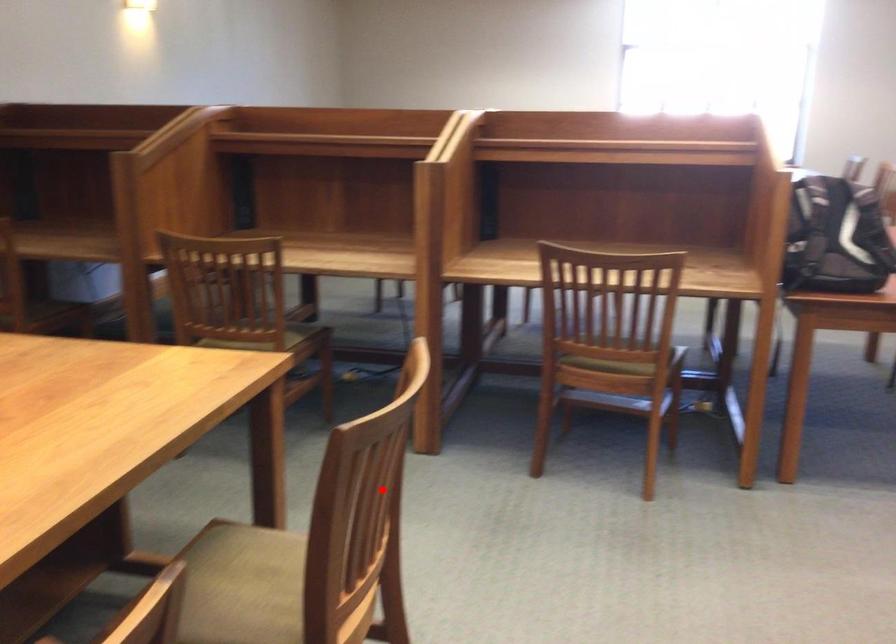
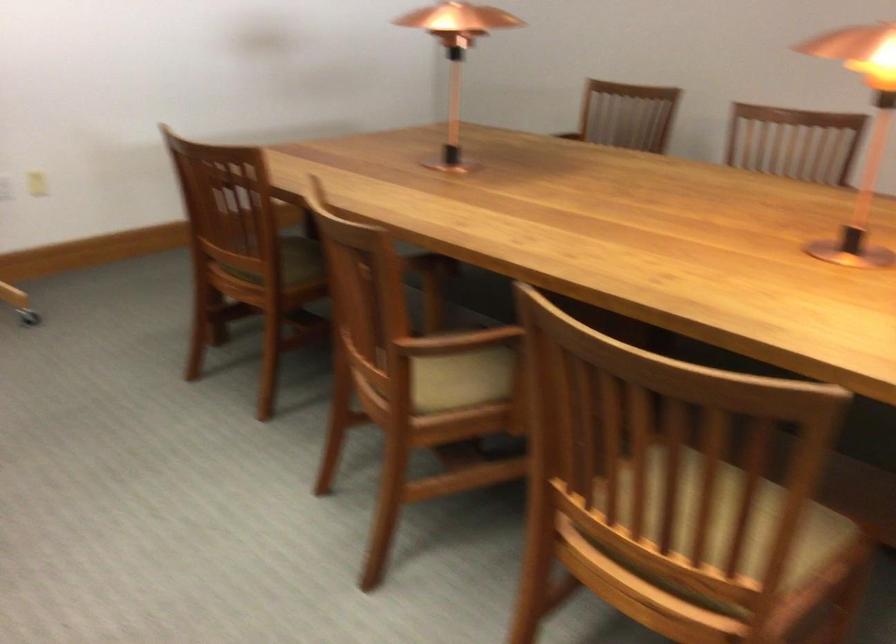
Question: I am providing you with two images of the same scene from different viewpoints. A red point is shown in image1. For the corresponding object point in image2, is it positioned nearer or farther from the camera?

Choices:
 (A) Nearer
 (B) Farther

Answer: (A)